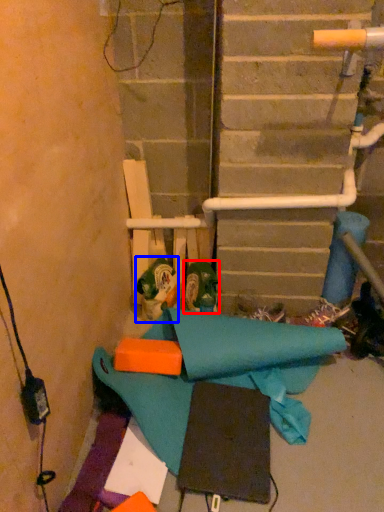
Question: Which of the following is the closest to the observer, footwear (highlighted by a red box) or toy (highlighted by a blue box)?

Choices:
 (A) footwear
 (B) toy

Answer: (A)